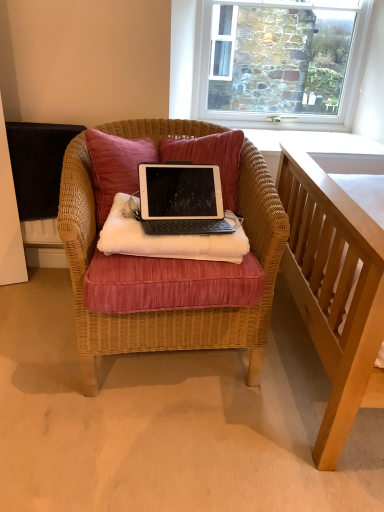
What is the approximate height of silver/black plastic laptop at center?

silver/black plastic laptop at center is 6.02 inches in height.

The height and width of the screenshot is (512, 384). What are the coordinates of `stone textured wall at upper center` in the screenshot? It's located at (279, 61).

This screenshot has height=512, width=384. What are the coordinates of `woven wicker chair at center` in the screenshot? It's located at (174, 311).

You are a GUI agent. You are given a task and a screenshot of the screen. Output one action in this format:
    pyautogui.click(x=<x>, y=<y>)
    Task: Click on the velvet pink pillow at center
    
    Given the screenshot: What is the action you would take?
    pyautogui.click(x=210, y=158)

You are a GUI agent. You are given a task and a screenshot of the screen. Output one action in this format:
    pyautogui.click(x=<x>, y=<y>)
    Task: Click on the black matte tablet at center
    The height and width of the screenshot is (512, 384).
    Given the screenshot: What is the action you would take?
    pyautogui.click(x=167, y=238)

Is stone textured wall at upper center facing away from velvet pink pillow at center?

No, stone textured wall at upper center is not facing away from velvet pink pillow at center.

Which is closer to the camera, (261, 8) or (170, 154)?

Point (261, 8).

Identify the location of pillow in front of the stone textured wall at upper center. The height and width of the screenshot is (512, 384). coord(210,158).

Between stone textured wall at upper center and velvet pink pillow at center, which one has larger size?

stone textured wall at upper center is bigger.

Are silver/black plastic laptop at center and woven wicker chair at center making contact?

silver/black plastic laptop at center is not next to woven wicker chair at center, and they're not touching.

Choose the correct answer: Is silver/black plastic laptop at center inside woven wicker chair at center or outside it?

silver/black plastic laptop at center exists entirely within woven wicker chair at center.

Which object is closer to the camera, silver/black plastic laptop at center or woven wicker chair at center?

Positioned in front is woven wicker chair at center.

Which object is thinner, silver/black plastic laptop at center or woven wicker chair at center?

silver/black plastic laptop at center is thinner.

Locate an element on the screen. This screenshot has width=384, height=512. laptop above the woven wicker chair at center (from the image's perspective) is located at coordinates (181, 199).

From a real-world perspective, is woven wicker chair at center located higher than silver/black plastic laptop at center?

Incorrect, from a real-world perspective, woven wicker chair at center is lower than silver/black plastic laptop at center.

Which object is more forward, woven wicker chair at center or silver/black plastic laptop at center?

woven wicker chair at center is more forward.

Is woven wicker chair at center bigger or smaller than silver/black plastic laptop at center?

Clearly, woven wicker chair at center is larger in size than silver/black plastic laptop at center.

Considering the sizes of black matte tablet at center and stone textured wall at upper center in the image, is black matte tablet at center wider or thinner than stone textured wall at upper center?

Considering their sizes, black matte tablet at center looks broader than stone textured wall at upper center.

Considering the relative sizes of black matte tablet at center and stone textured wall at upper center in the image provided, is black matte tablet at center shorter than stone textured wall at upper center?

Indeed, black matte tablet at center has a lesser height compared to stone textured wall at upper center.

Is black matte tablet at center bigger than stone textured wall at upper center?

No, black matte tablet at center is not bigger than stone textured wall at upper center.

Is black matte tablet at center in contact with stone textured wall at upper center?

No, black matte tablet at center is not with stone textured wall at upper center.

Is the depth of black matte tablet at center less than that of woven wicker chair at center?

No, black matte tablet at center is further to the viewer.

From the image's perspective, which object appears higher, black matte tablet at center or woven wicker chair at center?

From the image's view, black matte tablet at center is above.

Measure the distance between black matte tablet at center and woven wicker chair at center.

black matte tablet at center is 8.83 inches from woven wicker chair at center.

Find the location of a particular element. This screenshot has width=384, height=512. chair below the black matte tablet at center (from the image's perspective) is located at coordinates (174, 311).

Can you confirm if black matte tablet at center is smaller than velvet pink pillow at center?

Yes, black matte tablet at center is smaller than velvet pink pillow at center.

Would you say black matte tablet at center is inside or outside velvet pink pillow at center?

black matte tablet at center is not inside velvet pink pillow at center, it's outside.

Is black matte tablet at center directly adjacent to velvet pink pillow at center?

black matte tablet at center and velvet pink pillow at center are clearly separated.

From a real-world perspective, which object stands above the other?

In real-world perspective, velvet pink pillow at center is above.

From their relative heights in the image, would you say velvet pink pillow at center is taller or shorter than silver/black plastic laptop at center?

In the image, velvet pink pillow at center appears to be taller than silver/black plastic laptop at center.

Is velvet pink pillow at center not inside silver/black plastic laptop at center?

Yes.

Which of these two, velvet pink pillow at center or silver/black plastic laptop at center, is wider?

Wider between the two is velvet pink pillow at center.

Is point (163, 144) closer or farther from the camera than point (153, 175)?

Clearly, point (163, 144) is more distant from the camera than point (153, 175).

This screenshot has width=384, height=512. I want to click on window on the right of velvet pink pillow at center, so click(279, 61).

Image resolution: width=384 pixels, height=512 pixels. I want to click on chair lying below the silver/black plastic laptop at center (from the image's perspective), so click(x=174, y=311).

From the image, which object appears to be farther from woven wicker chair at center, velvet pink pillow at center or stone textured wall at upper center?

stone textured wall at upper center is further to woven wicker chair at center.

Estimate the real-world distances between objects in this image. Which object is further from stone textured wall at upper center, woven wicker chair at center or velvet pink pillow at center?

woven wicker chair at center is further to stone textured wall at upper center.

Looking at the image, which one is located closer to velvet pink pillow at center, silver/black plastic laptop at center or woven wicker chair at center?

silver/black plastic laptop at center.

Based on their spatial positions, is black matte tablet at center or velvet pink pillow at center closer to stone textured wall at upper center?

Based on the image, velvet pink pillow at center appears to be nearer to stone textured wall at upper center.

Based on their spatial positions, is velvet pink pillow at center or silver/black plastic laptop at center further from stone textured wall at upper center?

The object further to stone textured wall at upper center is silver/black plastic laptop at center.

Estimate the real-world distances between objects in this image. Which object is further from velvet pink pillow at center, stone textured wall at upper center or woven wicker chair at center?

stone textured wall at upper center lies further to velvet pink pillow at center than the other object.

When comparing their distances from silver/black plastic laptop at center, does woven wicker chair at center or stone textured wall at upper center seem closer?

woven wicker chair at center is positioned closer to the anchor silver/black plastic laptop at center.

From the picture: Considering their positions, is stone textured wall at upper center positioned closer to woven wicker chair at center than silver/black plastic laptop at center?

The object closer to woven wicker chair at center is silver/black plastic laptop at center.

Identify the location of tablet computer between woven wicker chair at center and stone textured wall at upper center from front to back. (167, 238).

The width and height of the screenshot is (384, 512). Identify the location of tablet computer positioned between silver/black plastic laptop at center and stone textured wall at upper center from near to far. (167, 238).

The width and height of the screenshot is (384, 512). I want to click on laptop located between woven wicker chair at center and black matte tablet at center in the depth direction, so click(x=181, y=199).

At what (x,y) coordinates should I click in order to perform the action: click on pillow between stone textured wall at upper center and black matte tablet at center from top to bottom. Please return your answer as a coordinate pair (x, y). This screenshot has height=512, width=384. Looking at the image, I should click on (210, 158).